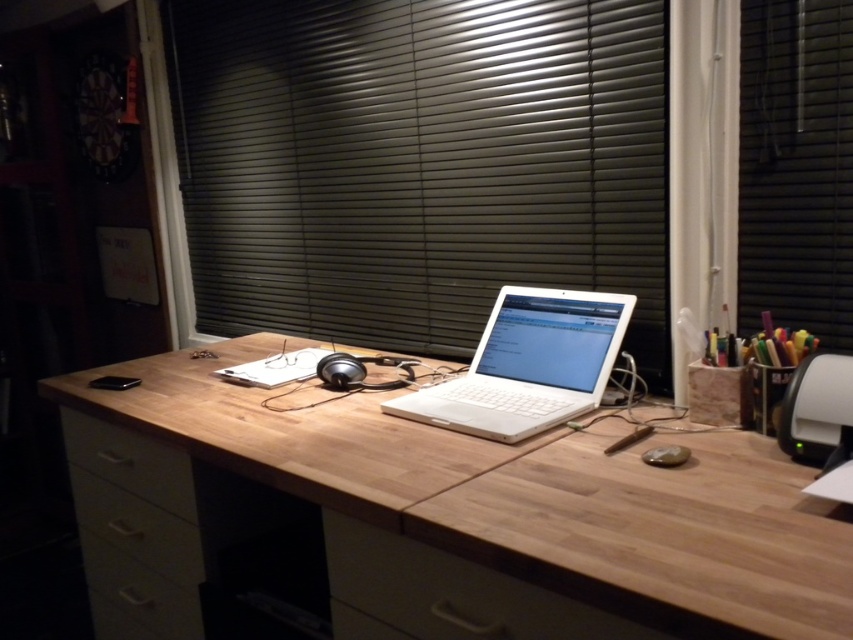
From the picture: You have a 12 inch wide notebook that you want to place on the wooden desk at center. The white matte laptop at center is already occupying the center area. Can the notebook fit on the desk without overlapping the laptop?

The wooden desk at center might be wider than the white matte laptop at center, so there is a possibility that the notebook can fit on the desk without overlapping the laptop. However, the exact dimensions are uncertain based on the provided information.

You are trying to place a large monitor on the wooden desk at center. The monitor requires 1 meter of space to the right of the white matte laptop at center. Is there enough space on the desk?

The wooden desk at center is to the left of the white matte laptop at center, so there is insufficient space to the right of the white matte laptop at center to accommodate the monitor requiring 1 meter of space.